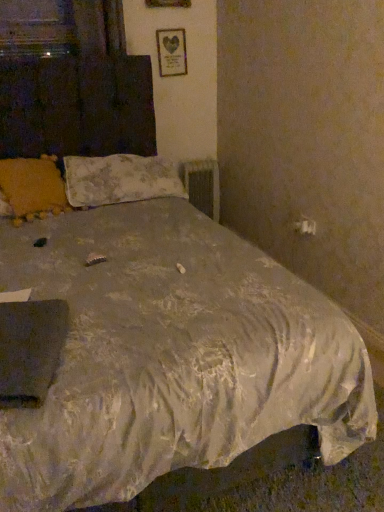
The image size is (384, 512). Find the location of `floral fabric pillow at upper left, which is the 2th pillow from left to right`. floral fabric pillow at upper left, which is the 2th pillow from left to right is located at coordinates (119, 179).

Identify the location of metallic silver radiator at center. The image size is (384, 512). (203, 185).

Between floral fabric pillow at upper left, which is the 2th pillow from left to right, and wooden frame with heart print at upper center, which one has more height?

Standing taller between the two is wooden frame with heart print at upper center.

Considering the relative positions of floral fabric pillow at upper left, which is the 2th pillow from left to right, and wooden frame with heart print at upper center in the image provided, is floral fabric pillow at upper left, which is the 2th pillow from left to right, to the right of wooden frame with heart print at upper center from the viewer's perspective?

Incorrect, floral fabric pillow at upper left, which is the 2th pillow from left to right, is not on the right side of wooden frame with heart print at upper center.

From the picture: How far apart are floral fabric pillow at upper left, arranged as the first pillow when viewed from the right, and wooden frame with heart print at upper center?

floral fabric pillow at upper left, arranged as the first pillow when viewed from the right, is 38.93 inches from wooden frame with heart print at upper center.

Is wooden frame with heart print at upper center surrounded by floral fabric pillow at upper left, which is the 2th pillow from left to right?

That's incorrect, wooden frame with heart print at upper center is not inside floral fabric pillow at upper left, which is the 2th pillow from left to right.

Considering the positions of objects metallic silver radiator at center and wooden frame with heart print at upper center in the image provided, who is behind, metallic silver radiator at center or wooden frame with heart print at upper center?

metallic silver radiator at center is more distant.

From the image's perspective, does metallic silver radiator at center appear lower than wooden frame with heart print at upper center?

Yes, from the image's perspective, metallic silver radiator at center is below wooden frame with heart print at upper center.

In the image, is metallic silver radiator at center on the left side or the right side of wooden frame with heart print at upper center?

Based on their positions, metallic silver radiator at center is located to the right of wooden frame with heart print at upper center.

Is metallic silver radiator at center oriented away from wooden frame with heart print at upper center?

No, metallic silver radiator at center is not facing the opposite direction of wooden frame with heart print at upper center.

How different are the orientations of floral fabric pillow at upper left, arranged as the first pillow when viewed from the right, and yellow fabric pillow at upper left, which ranks as the first pillow in left-to-right order, in degrees?

The facing directions of floral fabric pillow at upper left, arranged as the first pillow when viewed from the right, and yellow fabric pillow at upper left, which ranks as the first pillow in left-to-right order, are 0.601 degrees apart.

Does point (161, 164) appear closer or farther from the camera than point (6, 203)?

Point (161, 164).

From the picture: From a real-world perspective, is floral fabric pillow at upper left, which is the 2th pillow from left to right, positioned under yellow fabric pillow at upper left, acting as the second pillow starting from the right, based on gravity?

Indeed, from a real-world perspective, floral fabric pillow at upper left, which is the 2th pillow from left to right, is positioned beneath yellow fabric pillow at upper left, acting as the second pillow starting from the right.

From the image's perspective, would you say floral fabric pillow at upper left, arranged as the first pillow when viewed from the right, is shown under yellow fabric pillow at upper left, acting as the second pillow starting from the right?

Actually, floral fabric pillow at upper left, arranged as the first pillow when viewed from the right, appears above yellow fabric pillow at upper left, acting as the second pillow starting from the right, in the image.

Image resolution: width=384 pixels, height=512 pixels. In order to click on radiator that appears on the right of floral fabric pillow at upper left, which is the 2th pillow from left to right in this screenshot , I will do 203,185.

From a real-world perspective, which object stands above the other?

floral fabric pillow at upper left, which is the 2th pillow from left to right, from a real-world perspective.

In terms of width, does floral fabric pillow at upper left, which is the 2th pillow from left to right, look wider or thinner when compared to metallic silver radiator at center?

Considering their sizes, floral fabric pillow at upper left, which is the 2th pillow from left to right, looks broader than metallic silver radiator at center.

Can you confirm if floral fabric pillow at upper left, which is the 2th pillow from left to right, is smaller than metallic silver radiator at center?

Actually, floral fabric pillow at upper left, which is the 2th pillow from left to right, might be larger than metallic silver radiator at center.

Measure the distance between yellow fabric pillow at upper left, which ranks as the first pillow in left-to-right order, and floral fabric pillow at upper left, arranged as the first pillow when viewed from the right.

yellow fabric pillow at upper left, which ranks as the first pillow in left-to-right order, is 10.08 inches from floral fabric pillow at upper left, arranged as the first pillow when viewed from the right.

Is yellow fabric pillow at upper left, which ranks as the first pillow in left-to-right order, positioned with its back to floral fabric pillow at upper left, arranged as the first pillow when viewed from the right?

yellow fabric pillow at upper left, which ranks as the first pillow in left-to-right order, does not have its back to floral fabric pillow at upper left, arranged as the first pillow when viewed from the right.

Between yellow fabric pillow at upper left, acting as the second pillow starting from the right, and floral fabric pillow at upper left, which is the 2th pillow from left to right, which one appears on the right side from the viewer's perspective?

floral fabric pillow at upper left, which is the 2th pillow from left to right, is more to the right.

Considering the sizes of yellow fabric pillow at upper left, which ranks as the first pillow in left-to-right order, and floral fabric pillow at upper left, arranged as the first pillow when viewed from the right, in the image, is yellow fabric pillow at upper left, which ranks as the first pillow in left-to-right order, bigger or smaller than floral fabric pillow at upper left, arranged as the first pillow when viewed from the right,?

yellow fabric pillow at upper left, which ranks as the first pillow in left-to-right order, is smaller than floral fabric pillow at upper left, arranged as the first pillow when viewed from the right.

From a real-world perspective, is wooden frame with heart print at upper center on top of yellow fabric pillow at upper left, acting as the second pillow starting from the right?

Indeed, from a real-world perspective, wooden frame with heart print at upper center stands above yellow fabric pillow at upper left, acting as the second pillow starting from the right.

Is wooden frame with heart print at upper center positioned beyond the bounds of yellow fabric pillow at upper left, which ranks as the first pillow in left-to-right order?

wooden frame with heart print at upper center is positioned outside yellow fabric pillow at upper left, which ranks as the first pillow in left-to-right order.

Consider the image. Between wooden frame with heart print at upper center and yellow fabric pillow at upper left, which ranks as the first pillow in left-to-right order, which one has less height?

yellow fabric pillow at upper left, which ranks as the first pillow in left-to-right order.

Considering the positions of point (176, 45) and point (43, 185), is point (176, 45) closer or farther from the camera than point (43, 185)?

Point (176, 45) is positioned farther from the camera compared to point (43, 185).

Based on their positions, is yellow fabric pillow at upper left, acting as the second pillow starting from the right, located to the left or right of wooden frame with heart print at upper center?

From the image, it's evident that yellow fabric pillow at upper left, acting as the second pillow starting from the right, is to the left of wooden frame with heart print at upper center.

Consider the image. From a real-world perspective, is yellow fabric pillow at upper left, which ranks as the first pillow in left-to-right order, above or below wooden frame with heart print at upper center?

Clearly, from a real-world perspective, yellow fabric pillow at upper left, which ranks as the first pillow in left-to-right order, is below wooden frame with heart print at upper center.

This screenshot has width=384, height=512. What are the coordinates of `picture frame above the floral fabric pillow at upper left, which is the 2th pillow from left to right (from a real-world perspective)` in the screenshot? It's located at (171, 52).

I want to click on radiator behind the wooden frame with heart print at upper center, so click(x=203, y=185).

Estimate the real-world distances between objects in this image. Which object is closer to wooden frame with heart print at upper center, metallic silver radiator at center or yellow fabric pillow at upper left, which ranks as the first pillow in left-to-right order?

metallic silver radiator at center.

From the image, which object appears to be farther from wooden frame with heart print at upper center, yellow fabric pillow at upper left, acting as the second pillow starting from the right, or metallic silver radiator at center?

yellow fabric pillow at upper left, acting as the second pillow starting from the right, is further to wooden frame with heart print at upper center.

When comparing their distances from floral fabric pillow at upper left, which is the 2th pillow from left to right, does wooden frame with heart print at upper center or metallic silver radiator at center seem closer?

metallic silver radiator at center lies closer to floral fabric pillow at upper left, which is the 2th pillow from left to right, than the other object.

From the image, which object appears to be farther from yellow fabric pillow at upper left, acting as the second pillow starting from the right, floral fabric pillow at upper left, arranged as the first pillow when viewed from the right, or metallic silver radiator at center?

metallic silver radiator at center lies further to yellow fabric pillow at upper left, acting as the second pillow starting from the right, than the other object.

Considering their positions, is yellow fabric pillow at upper left, which ranks as the first pillow in left-to-right order, positioned closer to floral fabric pillow at upper left, arranged as the first pillow when viewed from the right, than metallic silver radiator at center?

The object closer to floral fabric pillow at upper left, arranged as the first pillow when viewed from the right, is yellow fabric pillow at upper left, which ranks as the first pillow in left-to-right order.

Considering their positions, is floral fabric pillow at upper left, which is the 2th pillow from left to right, positioned further to yellow fabric pillow at upper left, which ranks as the first pillow in left-to-right order, than wooden frame with heart print at upper center?

wooden frame with heart print at upper center is further to yellow fabric pillow at upper left, which ranks as the first pillow in left-to-right order.

Based on their spatial positions, is wooden frame with heart print at upper center or floral fabric pillow at upper left, which is the 2th pillow from left to right, further from metallic silver radiator at center?

Among the two, floral fabric pillow at upper left, which is the 2th pillow from left to right, is located further to metallic silver radiator at center.

Considering their positions, is metallic silver radiator at center positioned further to wooden frame with heart print at upper center than floral fabric pillow at upper left, which is the 2th pillow from left to right?

Among the two, floral fabric pillow at upper left, which is the 2th pillow from left to right, is located further to wooden frame with heart print at upper center.

The image size is (384, 512). What are the coordinates of `pillow located between yellow fabric pillow at upper left, acting as the second pillow starting from the right, and metallic silver radiator at center in the depth direction` in the screenshot? It's located at (119, 179).

At what (x,y) coordinates should I click in order to perform the action: click on radiator between wooden frame with heart print at upper center and floral fabric pillow at upper left, which is the 2th pillow from left to right, in the up-down direction. Please return your answer as a coordinate pair (x, y). The width and height of the screenshot is (384, 512). Looking at the image, I should click on (203, 185).

Find the location of `pillow between wooden frame with heart print at upper center and yellow fabric pillow at upper left, acting as the second pillow starting from the right, in the up-down direction`. pillow between wooden frame with heart print at upper center and yellow fabric pillow at upper left, acting as the second pillow starting from the right, in the up-down direction is located at coordinates (119, 179).

The height and width of the screenshot is (512, 384). In order to click on radiator between wooden frame with heart print at upper center and yellow fabric pillow at upper left, acting as the second pillow starting from the right, in the up-down direction in this screenshot , I will do `click(203, 185)`.